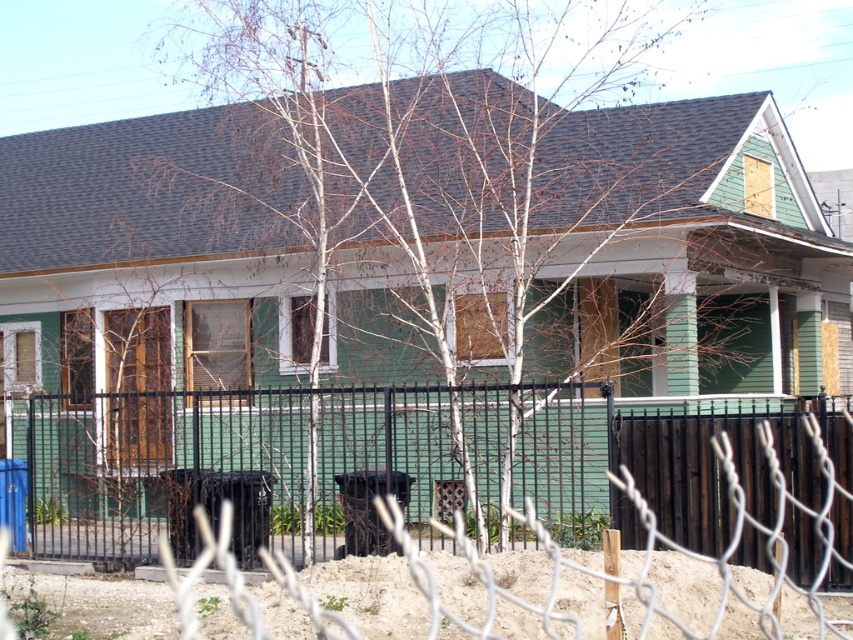
Does point (178, 508) lie behind point (660, 422)?

Yes, it is behind point (660, 422).

Does black metal fence at center have a smaller size compared to dark brown wood fence at center?

Yes.

Who is more forward, (91, 445) or (822, 412)?

Point (822, 412)

Locate an element on the screen. The height and width of the screenshot is (640, 853). black metal fence at center is located at coordinates (310, 465).